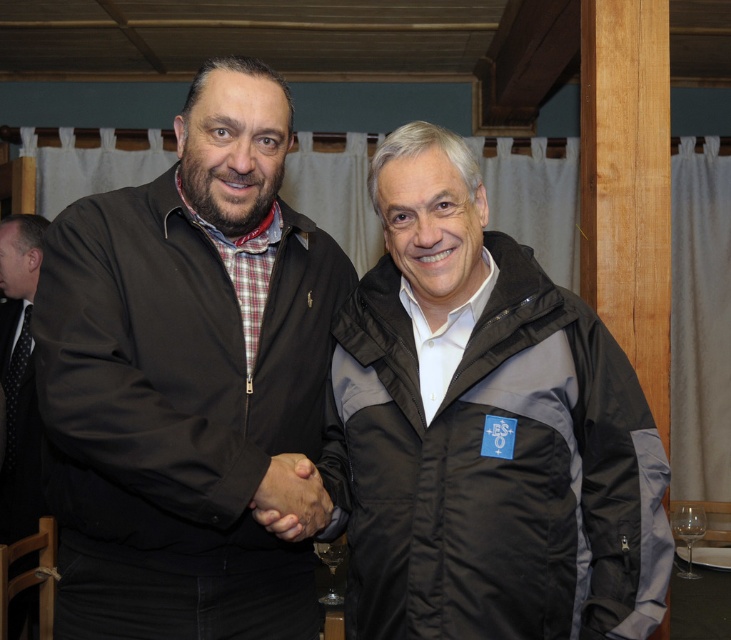
Question: Can you confirm if black puffy jacket at center is smaller than transparent glass at lower right?

Choices:
 (A) no
 (B) yes

Answer: (A)

Question: Which point is farther to the camera?

Choices:
 (A) (674, 509)
 (B) (34, 269)
 (C) (317, 548)
 (D) (583, 512)

Answer: (B)

Question: Among these points, which one is nearest to the camera?

Choices:
 (A) (1, 253)
 (B) (686, 504)
 (C) (333, 554)
 (D) (423, 595)

Answer: (D)

Question: Which is farther from the black textured suit at left?

Choices:
 (A) transparent glass at lower right
 (B) transparent glass at lower center
 (C) matte black jacket at left
 (D) black puffy jacket at center

Answer: (A)

Question: Can you confirm if matte black jacket at left is smaller than transparent glass at lower right?

Choices:
 (A) no
 (B) yes

Answer: (A)

Question: Does black puffy jacket at center appear on the left side of transparent glass at lower right?

Choices:
 (A) no
 (B) yes

Answer: (B)